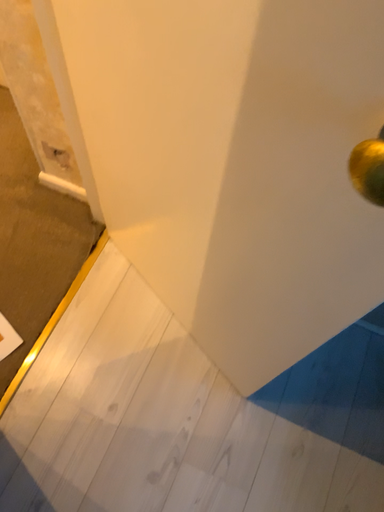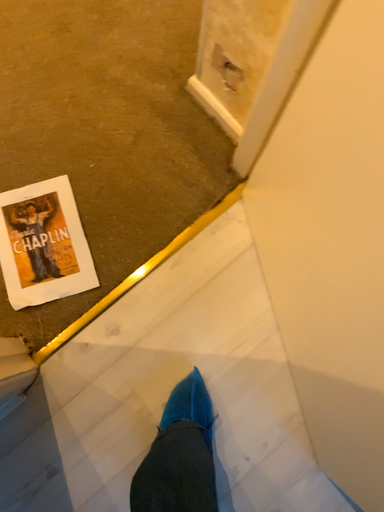
Question: How did the camera likely rotate when shooting the video?

Choices:
 (A) rotated downward
 (B) rotated upward

Answer: (A)